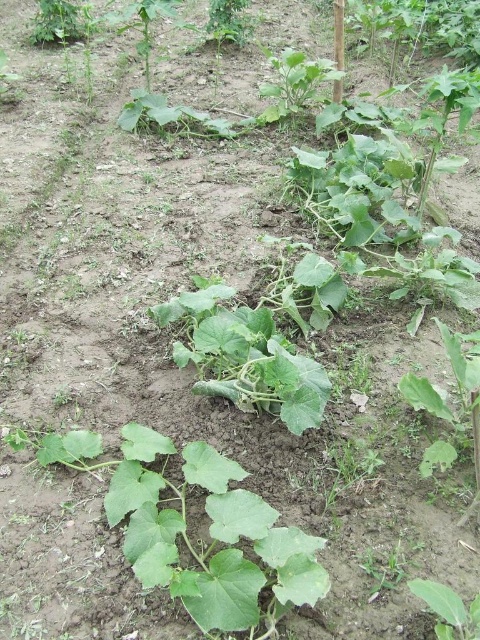
You are a gardener looking at the garden bed. You notice two plants, the green matte leafy plant at center and the green leafy plant at lower right. Which plant is closer to you?

The green matte leafy plant at center is closer to you because the green leafy plant at lower right is behind it.

You are a gardener checking the garden bed. You notice a point marked at coordinates [294,84]. What type of plant is located at that point?

The point at coordinates [294,84] corresponds to a green leafy plant at upper center.

You are a gardener who wants to transplant the smaller plant to a new pot. Which of the two plants, the green matte leafy plant at center or the green leafy plant at lower right, should you choose for transplanting based on their size?

The green leafy plant at lower right is smaller than the green matte leafy plant at center, so you should choose the green leafy plant at lower right for transplanting since it is smaller and easier to handle.